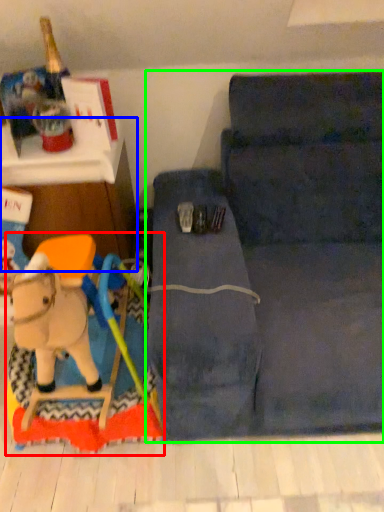
Question: Which object is the farthest from toy (highlighted by a red box)? Choose among these: furniture (highlighted by a blue box) or studio couch (highlighted by a green box).

Choices:
 (A) furniture
 (B) studio couch

Answer: (B)